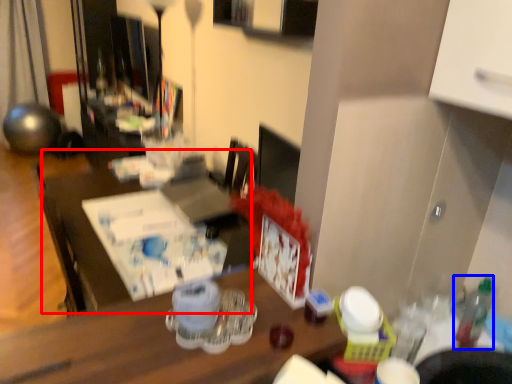
Question: Which object is further to the camera taking this photo, table (highlighted by a red box) or bottle (highlighted by a blue box)?

Choices:
 (A) table
 (B) bottle

Answer: (A)